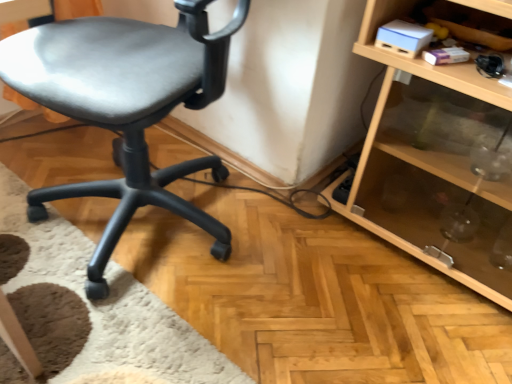
You are a GUI agent. You are given a task and a screenshot of the screen. Output one action in this format:
    pyautogui.click(x=<x>, y=<y>)
    Task: Click on the vacant area situated below matte black chair at left (from a real-world perspective)
    This screenshot has height=384, width=512.
    Given the screenshot: What is the action you would take?
    click(x=130, y=221)